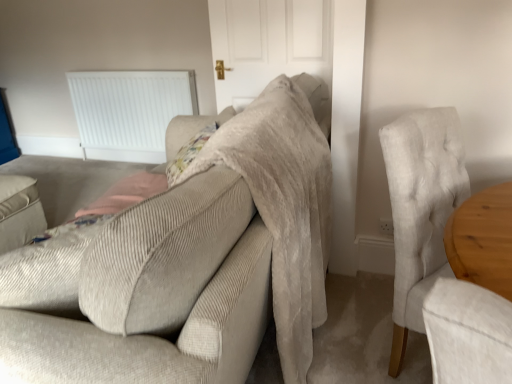
Question: Would you say beige corduroy couch at center is inside or outside light gray fabric chair at right?

Choices:
 (A) outside
 (B) inside

Answer: (A)

Question: Is point (158, 258) positioned closer to the camera than point (406, 231)?

Choices:
 (A) closer
 (B) farther

Answer: (A)

Question: Estimate the real-world distances between objects in this image. Which object is farther from the white plastic radiator at upper left?

Choices:
 (A) white matte door at center
 (B) beige corduroy couch at center
 (C) light gray fabric chair at right

Answer: (C)

Question: Estimate the real-world distances between objects in this image. Which object is farther from the beige corduroy couch at center?

Choices:
 (A) white matte door at center
 (B) light gray fabric chair at right
 (C) white plastic radiator at upper left

Answer: (C)